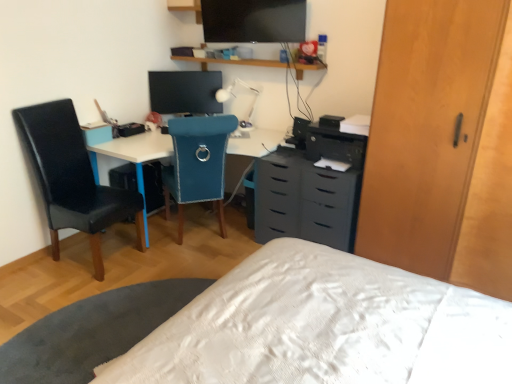
Image resolution: width=512 pixels, height=384 pixels. In order to click on free spot below black leather chair at left, placed as the second chair when sorted from right to left (from a real-world perspective) in this screenshot , I will do `click(89, 259)`.